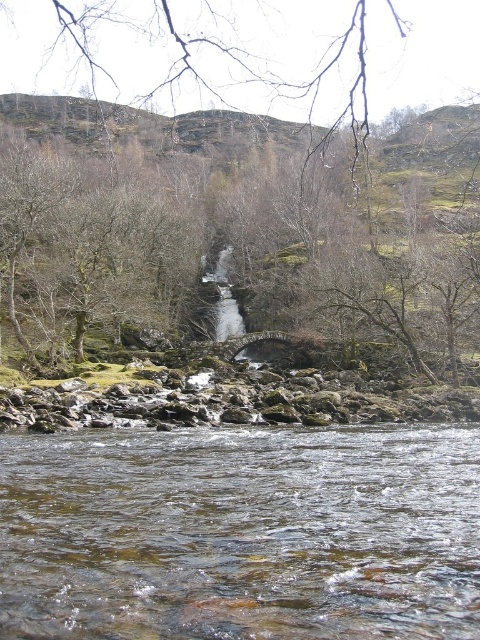
You are planning to cross the river using a small boat that is 200 feet long. Based on the scene, can your boat fit between the brown leafless tree at center and the clear water at center?

The brown leafless tree at center and clear water at center are 215.32 feet apart. Since the boat is 200 feet long, it can fit between them as there is enough space.

You are standing at the stone bridge in the midground of the serene natural landscape. You see a point marked at coordinates point [233,228]. What object is located at that point?

The point [233,228] corresponds to a brown leafless tree at center.